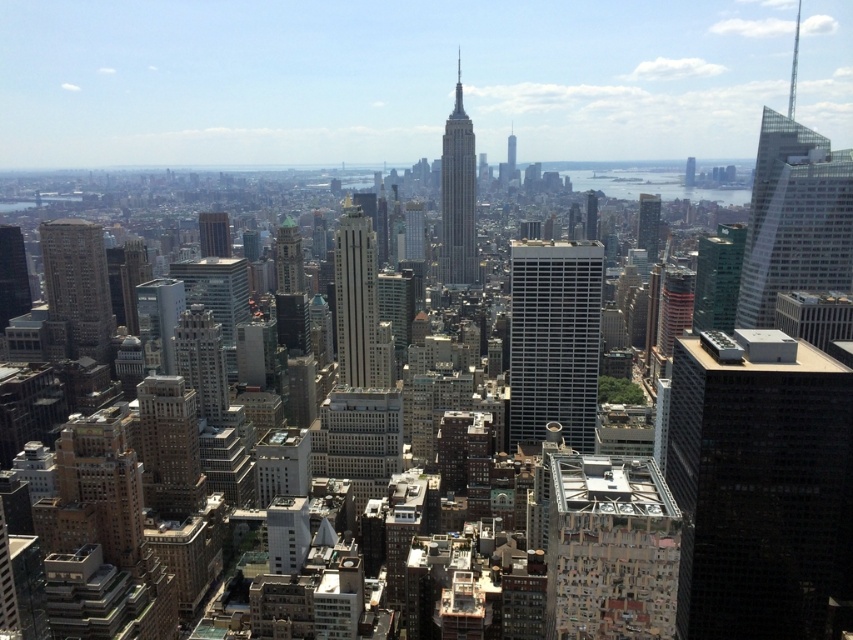
You are a drone operator trying to deliver a package to the Empire State Building. Your GPS shows a point at coordinates (717, 278). What landmark should you avoid to ensure you don not land on the green glass building at center right?

The point at coordinates (717, 278) corresponds to the green glass building at center right, so you should avoid landing there to ensure you do not mistakenly deliver the package to the green glass building at center right instead of the Empire State Building.